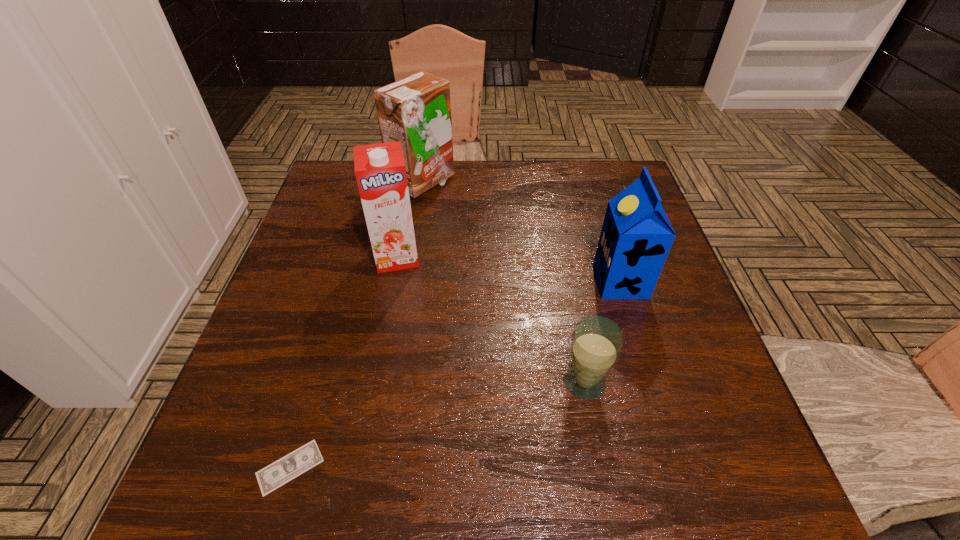
In the image, there is a desktop. Where is `free space at the right edge`? free space at the right edge is located at coordinates (704, 368).

I want to click on free spot between the farthest carton and the rightmost carton, so click(x=521, y=232).

This screenshot has width=960, height=540. Identify the location of free area in between the farthest carton and the nearest object. (356, 325).

Locate an element on the screen. Image resolution: width=960 pixels, height=540 pixels. empty space that is in between the rightmost carton and the farthest carton is located at coordinates (521, 232).

Identify the location of free spot between the farthest object and the nearest object. Image resolution: width=960 pixels, height=540 pixels. (356, 325).

Where is `the second closest object to the money`? The height and width of the screenshot is (540, 960). the second closest object to the money is located at coordinates (597, 343).

Locate which object ranks fourth in proximity to the rightmost object. Please provide its 2D coordinates. Your answer should be formatted as a tuple, i.e. [(x, y)], where the tuple contains the x and y coordinates of a point satisfying the conditions above.

[(275, 475)]

Identify which carton is the third nearest to the money. Please provide its 2D coordinates. Your answer should be formatted as a tuple, i.e. [(x, y)], where the tuple contains the x and y coordinates of a point satisfying the conditions above.

[(416, 110)]

Identify which carton is located as the third nearest to the shortest object. Please provide its 2D coordinates. Your answer should be formatted as a tuple, i.e. [(x, y)], where the tuple contains the x and y coordinates of a point satisfying the conditions above.

[(416, 110)]

At what (x,y) coordinates should I click in order to perform the action: click on vacant space that satisfies the following two spatial constraints: 1. on the straw side of the farthest carton; 2. on the back side of the fourth farthest object. Please return your answer as a coordinate pair (x, y). The width and height of the screenshot is (960, 540). Looking at the image, I should click on (391, 382).